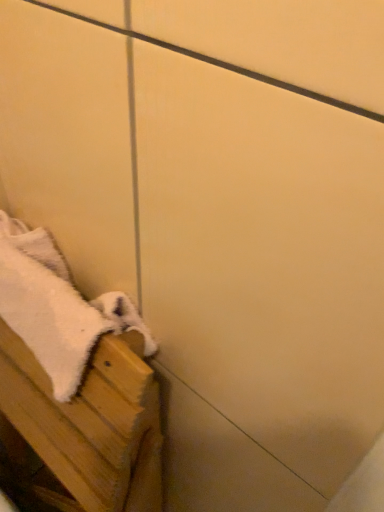
Question: Is white fluffy towel at lower left turned away from white fluffy towel at lower left?

Choices:
 (A) yes
 (B) no

Answer: (A)

Question: Is white fluffy towel at lower left taller than white fluffy towel at lower left?

Choices:
 (A) yes
 (B) no

Answer: (B)

Question: Is white fluffy towel at lower left to the left of white fluffy towel at lower left from the viewer's perspective?

Choices:
 (A) yes
 (B) no

Answer: (B)

Question: Does white fluffy towel at lower left appear on the right side of white fluffy towel at lower left?

Choices:
 (A) yes
 (B) no

Answer: (A)

Question: Is white fluffy towel at lower left not close to white fluffy towel at lower left?

Choices:
 (A) no
 (B) yes

Answer: (A)

Question: From the image's perspective, is white fluffy towel at lower left located above white fluffy towel at lower left?

Choices:
 (A) no
 (B) yes

Answer: (B)

Question: Is white fluffy towel at lower left a part of white fluffy towel at lower left?

Choices:
 (A) no
 (B) yes

Answer: (B)

Question: Is white fluffy towel at lower left positioned beyond the bounds of white fluffy towel at lower left?

Choices:
 (A) yes
 (B) no

Answer: (A)

Question: From the image's perspective, is white fluffy towel at lower left above white fluffy towel at lower left?

Choices:
 (A) no
 (B) yes

Answer: (A)

Question: Is the depth of white fluffy towel at lower left greater than that of white fluffy towel at lower left?

Choices:
 (A) yes
 (B) no

Answer: (B)

Question: Is white fluffy towel at lower left wider than white fluffy towel at lower left?

Choices:
 (A) no
 (B) yes

Answer: (B)

Question: Is white fluffy towel at lower left not close to white fluffy towel at lower left?

Choices:
 (A) no
 (B) yes

Answer: (A)

Question: From the image's perspective, relative to white fluffy towel at lower left, is white fluffy towel at lower left above or below?

Choices:
 (A) below
 (B) above

Answer: (A)